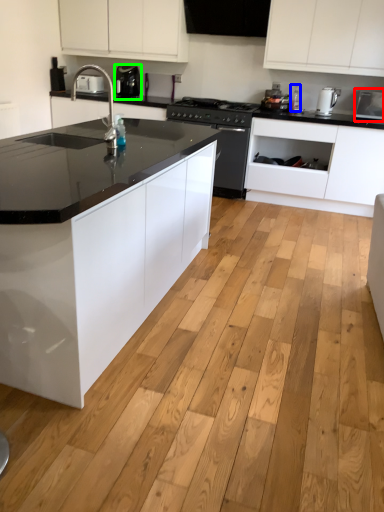
Question: Which is nearer to the appliance (highlighted by a red box)? bottle (highlighted by a blue box) or kitchen appliance (highlighted by a green box).

Choices:
 (A) bottle
 (B) kitchen appliance

Answer: (A)